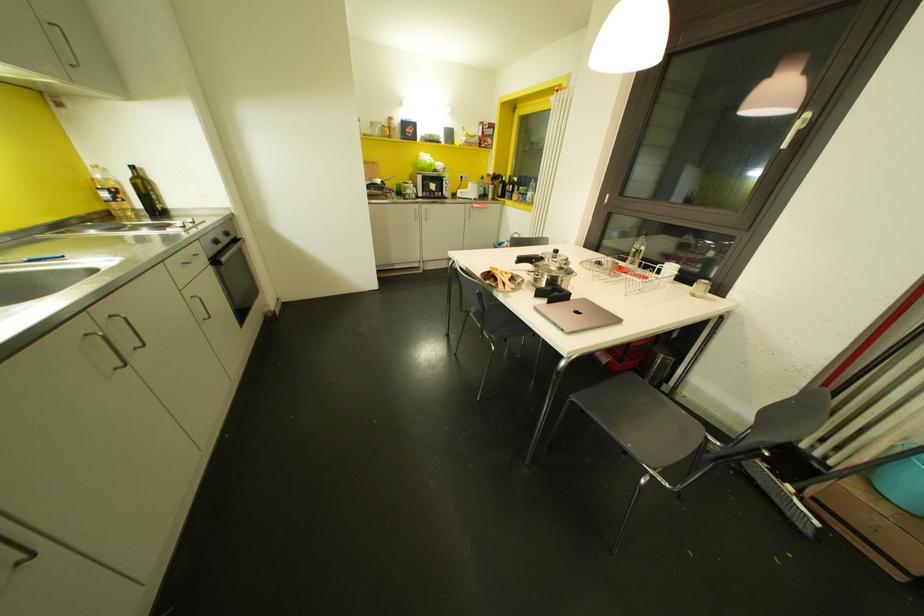
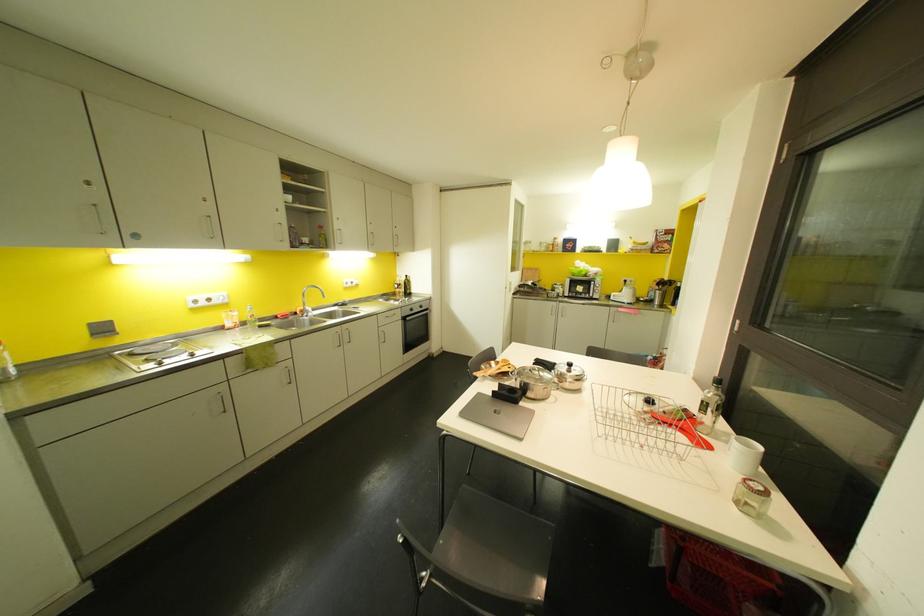
In the second image, find the point that corresponds to point 693,294 in the first image.

(736, 501)